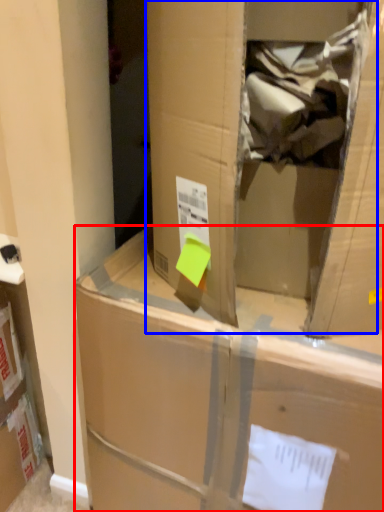
Question: Which of the following is the closest to the observer, box (highlighted by a red box) or cardboard box (highlighted by a blue box)?

Choices:
 (A) box
 (B) cardboard box

Answer: (B)